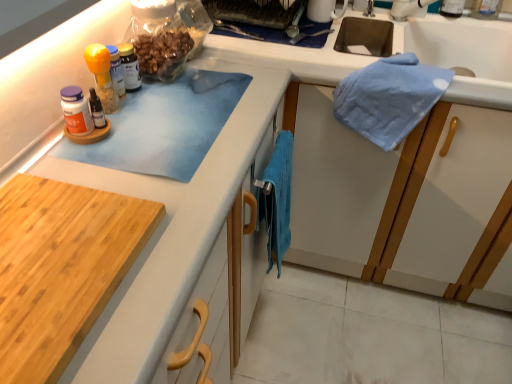
Where is `unoccupied region to the right of translucent plastic bottle at center`? unoccupied region to the right of translucent plastic bottle at center is located at coordinates (194, 91).